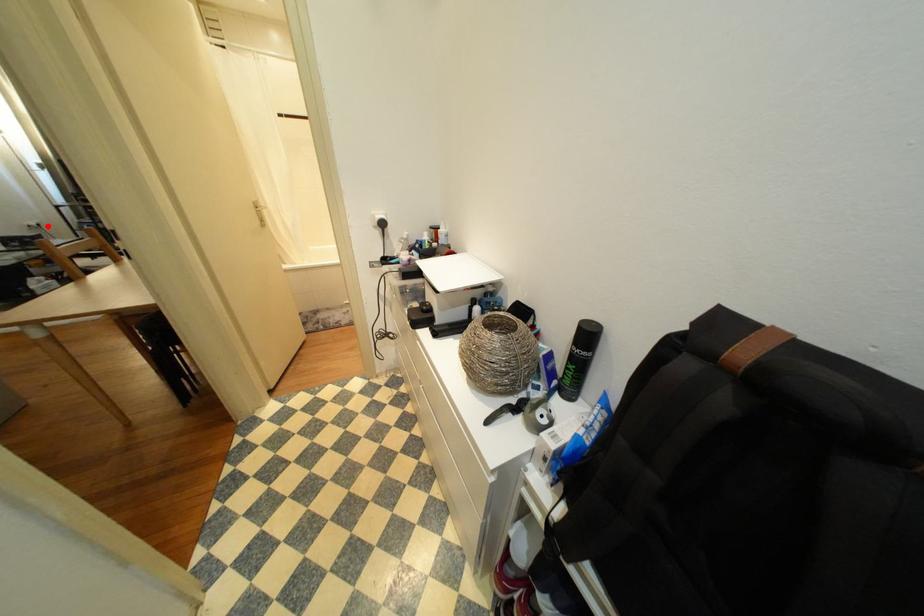
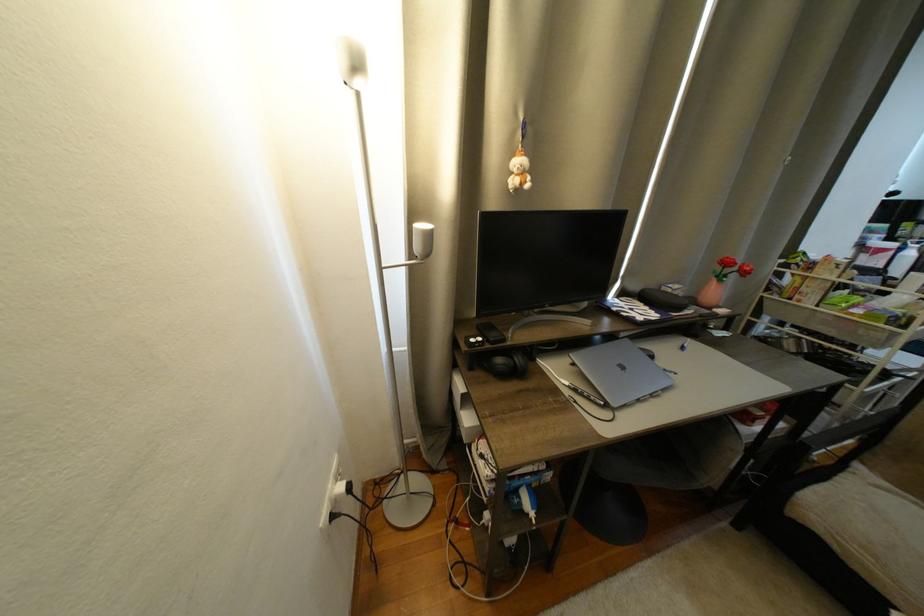
Locate, in the second image, the point that corresponds to the highlighted location in the first image.

(358, 490)